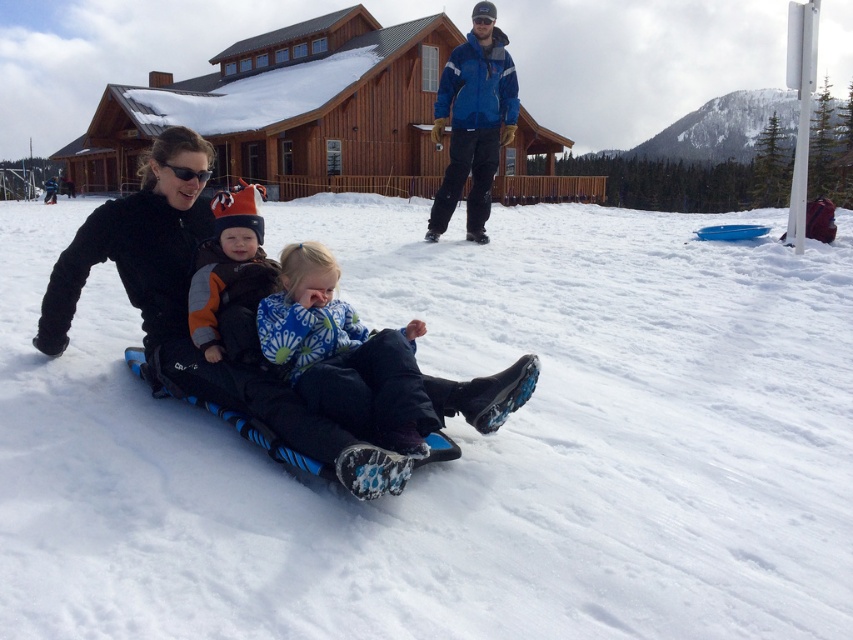
This screenshot has width=853, height=640. Describe the element at coordinates (138, 250) in the screenshot. I see `black fleece jacket at lower left` at that location.

At what (x,y) coordinates should I click in order to perform the action: click on black fleece jacket at lower left. Please return your answer as a coordinate pair (x, y). The height and width of the screenshot is (640, 853). Looking at the image, I should click on (138, 250).

Does blue fleece jacket at center appear on the left side of black matte goggles at upper left?

In fact, blue fleece jacket at center is to the right of black matte goggles at upper left.

What do you see at coordinates (344, 355) in the screenshot?
I see `blue fleece jacket at center` at bounding box center [344, 355].

Is point (397, 429) less distant than point (183, 177)?

Yes, point (397, 429) is closer to viewer.

Where is `blue fleece jacket at center`? This screenshot has height=640, width=853. blue fleece jacket at center is located at coordinates (344, 355).

Which is more to the right, white snow at center or black fleece jacket at lower left?

white snow at center

Between white snow at center and black fleece jacket at lower left, which one is positioned higher?

white snow at center is above.

Which is behind, point (548, 616) or point (73, 266)?

The point (73, 266) is more distant.

At what (x,y) coordinates should I click in order to perform the action: click on white snow at center. Please return your answer as a coordinate pair (x, y). The height and width of the screenshot is (640, 853). Looking at the image, I should click on (457, 444).